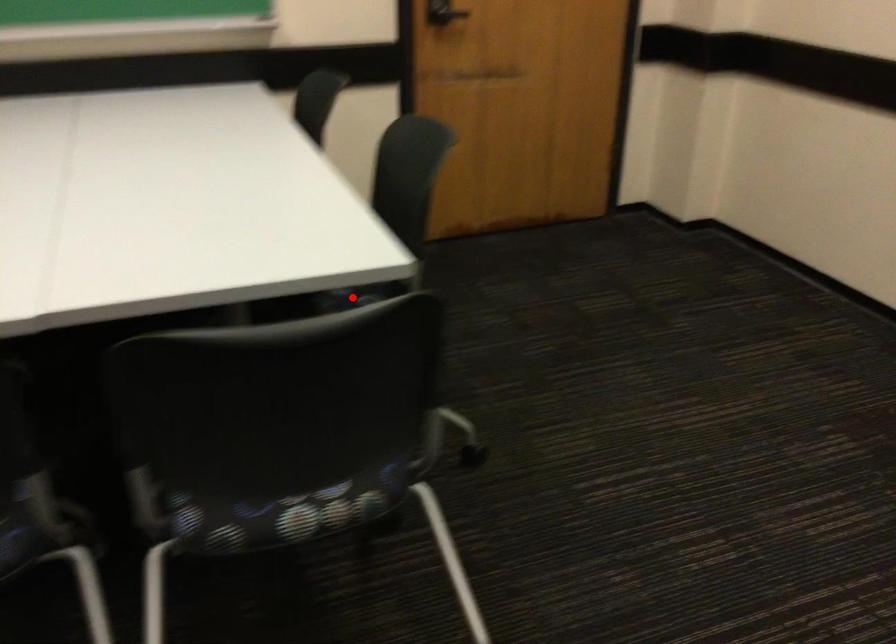
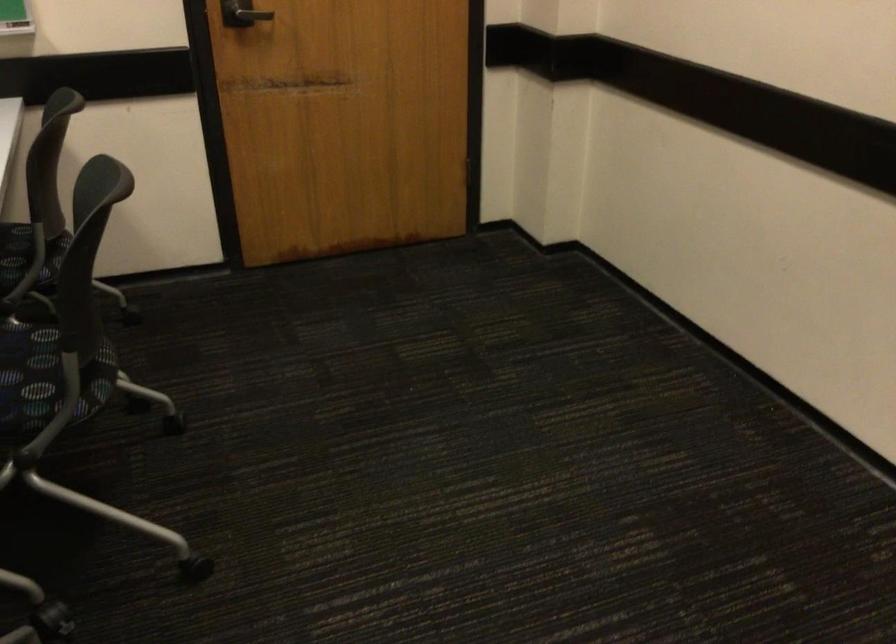
Question: A red point is marked in image1. In image2, is the corresponding 3D point closer to the camera or farther? Reply with the corresponding letter.

Choices:
 (A) The corresponding 3D point is closer.
 (B) The corresponding 3D point is farther.

Answer: (A)